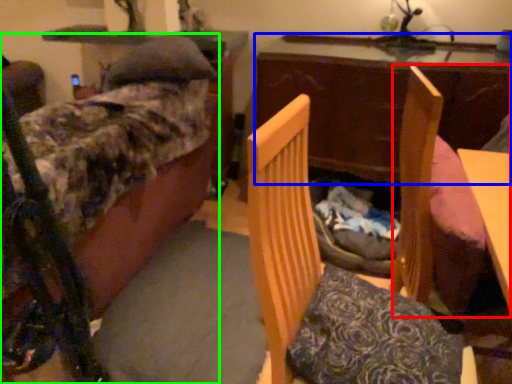
Question: Based on their relative distances, which object is nearer to swivel chair (highlighted by a red box)? Choose from table (highlighted by a blue box) and furniture (highlighted by a green box).

Choices:
 (A) table
 (B) furniture

Answer: (A)